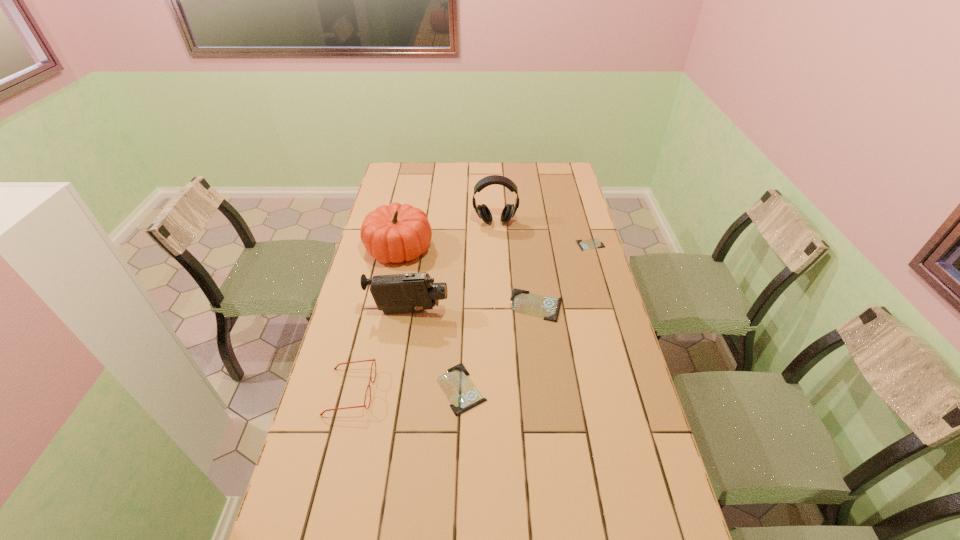
Locate an element on the screen. vacant space located 0.060m on the front of the second nearest identity card is located at coordinates (540, 336).

In order to click on vacant region located on the front of the rightmost object in this screenshot , I will do `click(595, 261)`.

This screenshot has width=960, height=540. What are the coordinates of `blank space located 0.310m on the ear cups of the earphone` in the screenshot? It's located at (497, 279).

Identify the location of vacant point located 0.130m on the back of the pumpkin. The height and width of the screenshot is (540, 960). (407, 211).

Find the location of a particular element. vacant space located on the front-facing side of the camcorder is located at coordinates (547, 312).

The height and width of the screenshot is (540, 960). What are the coordinates of `vacant space located on the face of the fourth tallest object` in the screenshot? It's located at (414, 391).

This screenshot has height=540, width=960. In order to click on pumpkin situated at the left edge in this screenshot , I will do `click(394, 233)`.

I want to click on camcorder at the left edge, so click(x=412, y=292).

This screenshot has width=960, height=540. What are the coordinates of `spectacles that is positioned at the left edge` in the screenshot? It's located at (373, 360).

I want to click on object that is at the right edge, so click(592, 243).